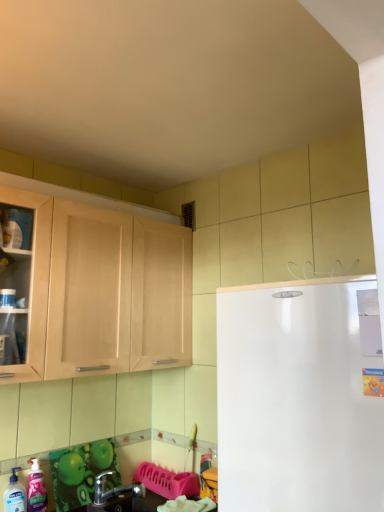
This screenshot has height=512, width=384. In order to click on vacant space behind metallic silver faucet at lower left in this screenshot , I will do `click(134, 498)`.